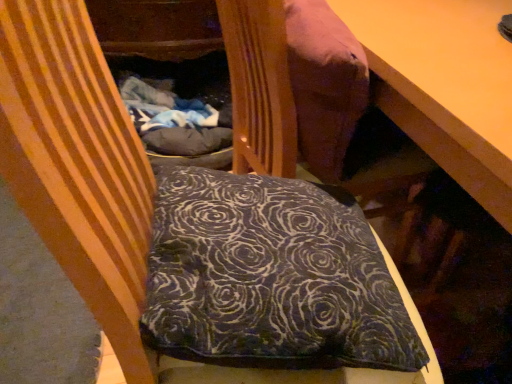
Describe the element at coordinates (270, 277) in the screenshot. I see `dark blue velvety pillow at center` at that location.

You are a GUI agent. You are given a task and a screenshot of the screen. Output one action in this format:
    pyautogui.click(x=<x>, y=<y>)
    Task: Click on the dark blue velvety pillow at center
    The height and width of the screenshot is (384, 512).
    Given the screenshot: What is the action you would take?
    pyautogui.click(x=270, y=277)

Where is `velvet-like brown bean bag at upper center`? The width and height of the screenshot is (512, 384). velvet-like brown bean bag at upper center is located at coordinates (259, 86).

Describe the element at coordinates (259, 86) in the screenshot. I see `velvet-like brown bean bag at upper center` at that location.

Find the location of `dark blue velvety pillow at center`. dark blue velvety pillow at center is located at coordinates (270, 277).

Considering the relative positions of velvet-like brown bean bag at upper center and dark blue velvety pillow at center in the image provided, is velvet-like brown bean bag at upper center to the left of dark blue velvety pillow at center from the viewer's perspective?

No.

Looking at this image, which is in front, velvet-like brown bean bag at upper center or dark blue velvety pillow at center?

Positioned in front is dark blue velvety pillow at center.

Is point (292, 115) closer or farther from the camera than point (176, 300)?

Point (292, 115).

From the image's perspective, which is below, velvet-like brown bean bag at upper center or dark blue velvety pillow at center?

dark blue velvety pillow at center.

From a real-world perspective, is velvet-like brown bean bag at upper center under dark blue velvety pillow at center?

No, from a real-world perspective, velvet-like brown bean bag at upper center is not under dark blue velvety pillow at center.

Looking at their sizes, would you say velvet-like brown bean bag at upper center is wider or thinner than dark blue velvety pillow at center?

In the image, velvet-like brown bean bag at upper center appears to be more narrow than dark blue velvety pillow at center.

Considering the relative sizes of velvet-like brown bean bag at upper center and dark blue velvety pillow at center in the image provided, is velvet-like brown bean bag at upper center shorter than dark blue velvety pillow at center?

No.

Between velvet-like brown bean bag at upper center and dark blue velvety pillow at center, which one has larger size?

velvet-like brown bean bag at upper center is bigger.

Is dark blue velvety pillow at center completely or partially inside velvet-like brown bean bag at upper center?

Definitely not — dark blue velvety pillow at center is not inside velvet-like brown bean bag at upper center.

Can you see velvet-like brown bean bag at upper center touching dark blue velvety pillow at center?

No, velvet-like brown bean bag at upper center is not with dark blue velvety pillow at center.

Is velvet-like brown bean bag at upper center facing towards dark blue velvety pillow at center?

No, velvet-like brown bean bag at upper center is not facing towards dark blue velvety pillow at center.

What's the angular difference between velvet-like brown bean bag at upper center and dark blue velvety pillow at center's facing directions?

There is a 103-degree angle between the facing directions of velvet-like brown bean bag at upper center and dark blue velvety pillow at center.

The width and height of the screenshot is (512, 384). Find the location of `pillow below the velvet-like brown bean bag at upper center (from the image's perspective)`. pillow below the velvet-like brown bean bag at upper center (from the image's perspective) is located at coordinates (270, 277).

Can you confirm if dark blue velvety pillow at center is positioned to the right of velvet-like brown bean bag at upper center?

No.

Which is behind, dark blue velvety pillow at center or velvet-like brown bean bag at upper center?

velvet-like brown bean bag at upper center is behind.

Considering the positions of point (255, 264) and point (281, 86), is point (255, 264) closer or farther from the camera than point (281, 86)?

Point (255, 264) is closer to the camera than point (281, 86).

In the scene shown: From the image's perspective, is dark blue velvety pillow at center on top of velvet-like brown bean bag at upper center?

No, from the image's perspective, dark blue velvety pillow at center is not on top of velvet-like brown bean bag at upper center.

In the scene shown: From a real-world perspective, which object stands above the other?

From a 3D spatial view, velvet-like brown bean bag at upper center is above.

Does dark blue velvety pillow at center have a lesser width compared to velvet-like brown bean bag at upper center?

In fact, dark blue velvety pillow at center might be wider than velvet-like brown bean bag at upper center.

Does dark blue velvety pillow at center have a lesser height compared to velvet-like brown bean bag at upper center?

Yes.

Considering the sizes of objects dark blue velvety pillow at center and velvet-like brown bean bag at upper center in the image provided, who is smaller, dark blue velvety pillow at center or velvet-like brown bean bag at upper center?

dark blue velvety pillow at center.

Is dark blue velvety pillow at center positioned beyond the bounds of velvet-like brown bean bag at upper center?

Yes, dark blue velvety pillow at center is outside of velvet-like brown bean bag at upper center.

Are dark blue velvety pillow at center and velvet-like brown bean bag at upper center located far from each other?

Actually, dark blue velvety pillow at center and velvet-like brown bean bag at upper center are a little close together.

Does dark blue velvety pillow at center turn towards velvet-like brown bean bag at upper center?

No, dark blue velvety pillow at center is not turned towards velvet-like brown bean bag at upper center.

Could you measure the distance between dark blue velvety pillow at center and velvet-like brown bean bag at upper center?

dark blue velvety pillow at center and velvet-like brown bean bag at upper center are 12.96 inches apart.

Where is `bean bag chair behind the dark blue velvety pillow at center`? The width and height of the screenshot is (512, 384). bean bag chair behind the dark blue velvety pillow at center is located at coordinates (259, 86).

This screenshot has width=512, height=384. In the image, there is a dark blue velvety pillow at center. What are the coordinates of `bean bag chair above it (from the image's perspective)` in the screenshot? It's located at coord(259,86).

At what (x,y) coordinates should I click in order to perform the action: click on pillow in front of the velvet-like brown bean bag at upper center. Please return your answer as a coordinate pair (x, y). Image resolution: width=512 pixels, height=384 pixels. Looking at the image, I should click on (270, 277).